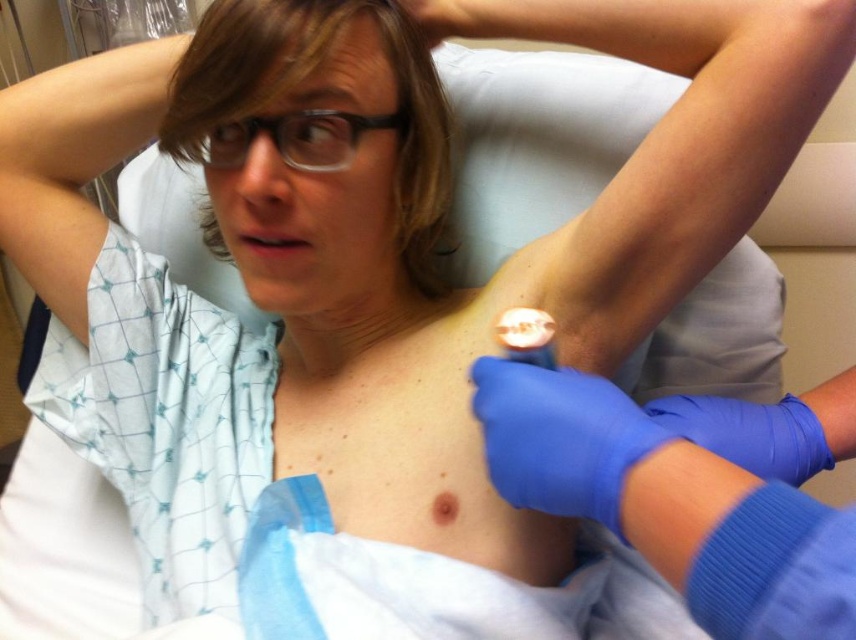
Identify the location of blue rubber glove at upper right. (688, 490).

Is point (708, 452) in front of point (317, 22)?

Yes, point (708, 452) is closer to viewer.

Between point (575, 424) and point (253, 67), which one is positioned behind?

The point (253, 67) is more distant.

Locate an element on the screen. blue rubber glove at upper right is located at coordinates (688, 490).

Which is below, blue rubber glove at upper right or blue latex glove at upper center?

blue rubber glove at upper right is lower down.

Can you confirm if blue rubber glove at upper right is thinner than blue latex glove at upper center?

No, blue rubber glove at upper right is not thinner than blue latex glove at upper center.

I want to click on blue rubber glove at upper right, so click(x=688, y=490).

Which is more to the right, blue latex glove at upper right or matte black hair at upper center?

Positioned to the right is blue latex glove at upper right.

Is point (746, 445) closer to viewer compared to point (276, 81)?

No, it is behind (276, 81).

Is point (809, 456) positioned behind point (382, 12)?

No.

This screenshot has width=856, height=640. In order to click on blue latex glove at upper right in this screenshot , I will do `click(750, 433)`.